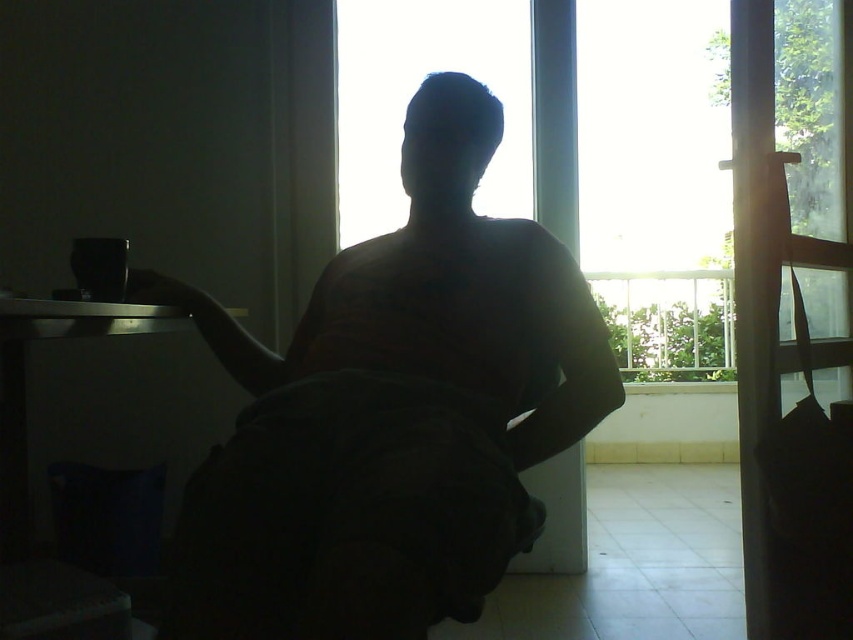
Question: Among these points, which one is farthest from the camera?

Choices:
 (A) (398, 445)
 (B) (817, 45)

Answer: (B)

Question: Is silhouette figure at center bigger than transparent glass window at center?

Choices:
 (A) no
 (B) yes

Answer: (A)

Question: Does silhouette figure at center appear under transparent glass window at center?

Choices:
 (A) yes
 (B) no

Answer: (A)

Question: Can you confirm if silhouette figure at center is positioned above transparent glass window at center?

Choices:
 (A) yes
 (B) no

Answer: (B)

Question: Which point is closer to the camera?

Choices:
 (A) transparent glass window at center
 (B) silhouette figure at center

Answer: (B)